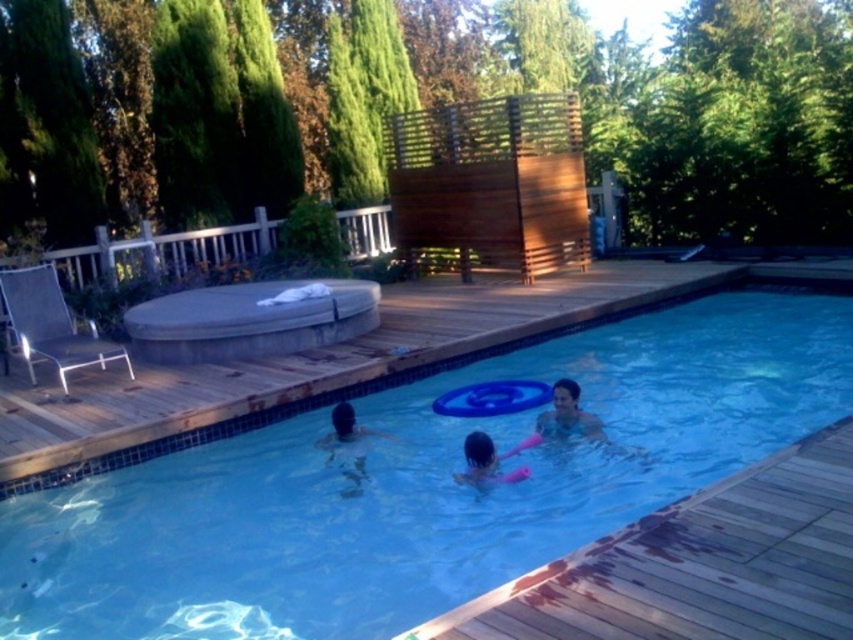
Does point (839, 556) come in front of point (486, 476)?

Yes, point (839, 556) is closer to viewer.

Is wooden deck at lower right to the left of pink rubber at center from the viewer's perspective?

Incorrect, wooden deck at lower right is not on the left side of pink rubber at center.

I want to click on wooden deck at lower right, so click(x=698, y=564).

Is point (254, 388) farther from viewer compared to point (554, 435)?

Yes.

Who is more distant from viewer, (476, 273) or (538, 433)?

The point (476, 273) is behind.

Describe the element at coordinates (321, 365) in the screenshot. I see `wooden deck at center` at that location.

The image size is (853, 640). What are the coordinates of `wooden deck at center` in the screenshot? It's located at (321, 365).

Does point (665, 433) lie in front of point (556, 432)?

No, it is not.

Who is more distant from viewer, [448,387] or [566,403]?

The point [448,387] is more distant.

Image resolution: width=853 pixels, height=640 pixels. I want to click on blue glossy water at center, so point(419,486).